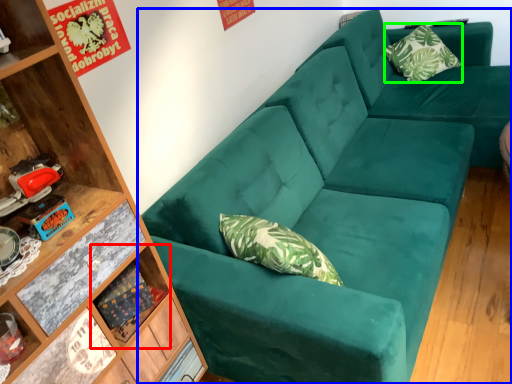
Question: Considering the real-world distances, which object is closest to shelf (highlighted by a red box)? studio couch (highlighted by a blue box) or pillow (highlighted by a green box).

Choices:
 (A) studio couch
 (B) pillow

Answer: (A)